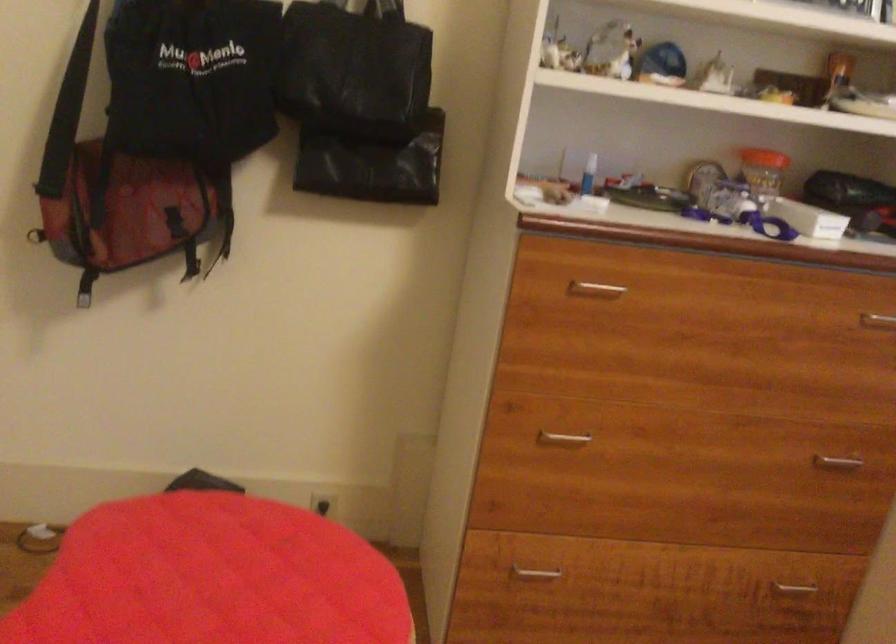
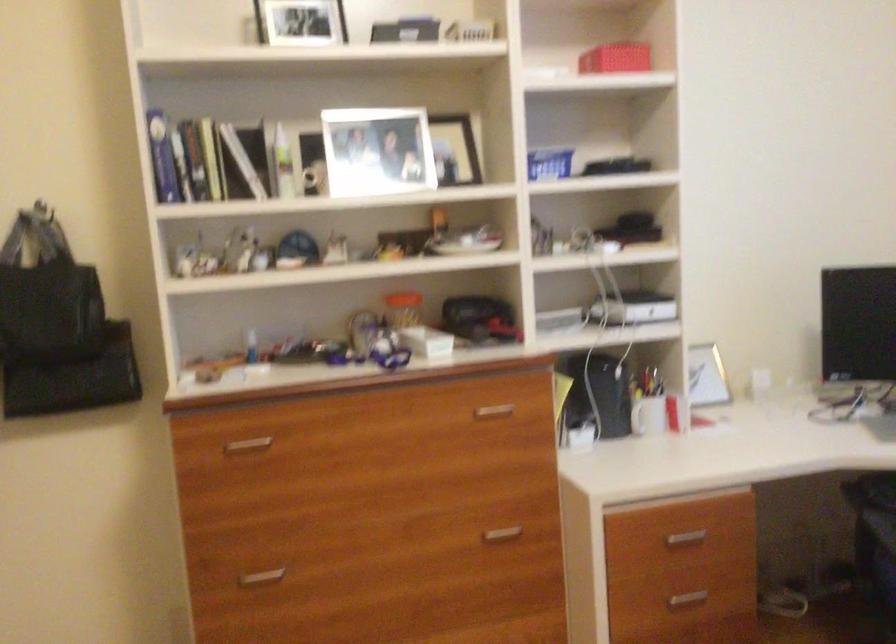
The point at (590, 285) is marked in the first image. Where is the corresponding point in the second image?

(247, 444)